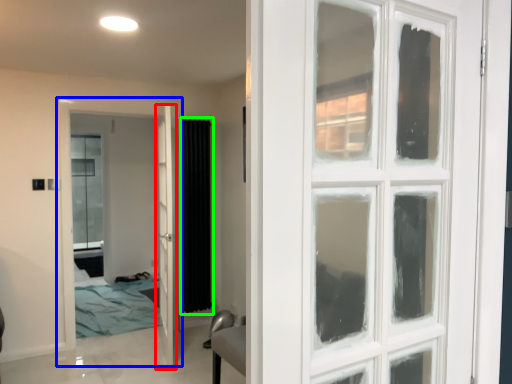
Question: Estimate the real-world distances between objects in this image. Which object is closer to door (highlighted by a red box), door (highlighted by a blue box) or curtain (highlighted by a green box)?

Choices:
 (A) door
 (B) curtain

Answer: (A)